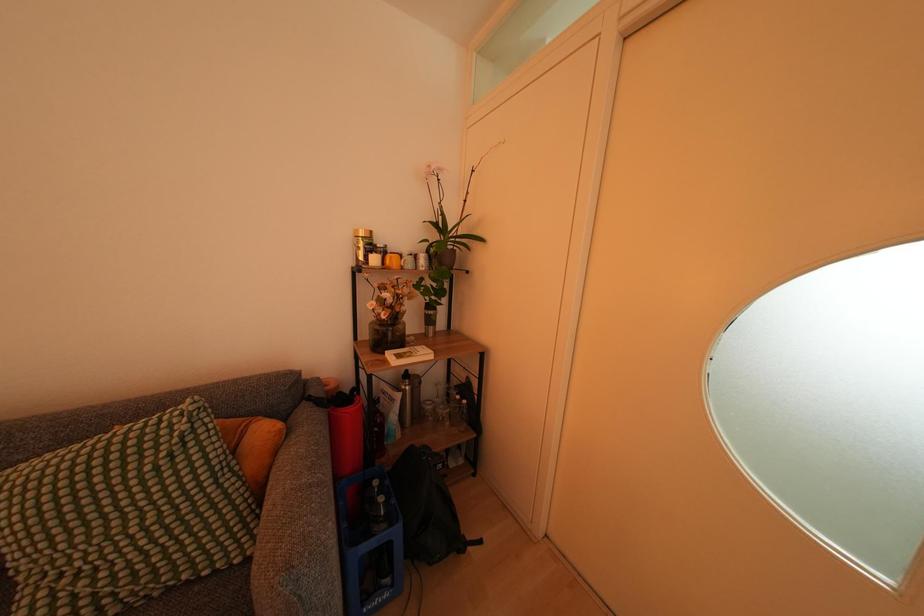
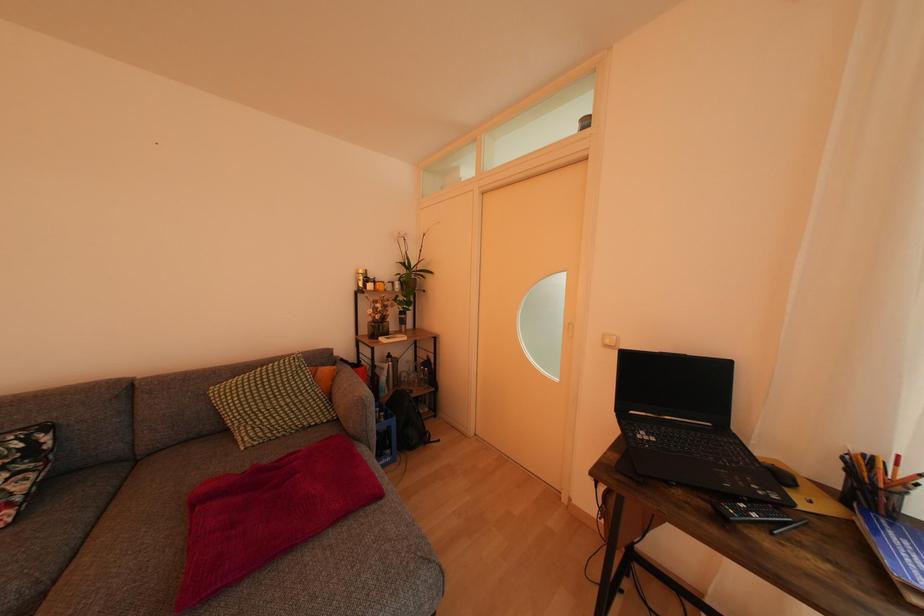
Question: What movement of the cameraman would produce the second image?

Choices:
 (A) Left
 (B) Right
 (C) Forward
 (D) Backward

Answer: (D)